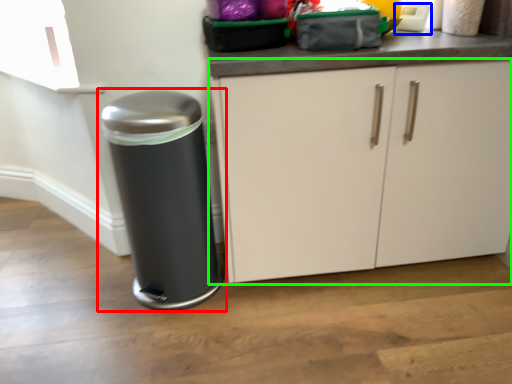
Question: Estimate the real-world distances between objects in this image. Which object is closer to waste container (highlighted by a red box), appliance (highlighted by a blue box) or cabinetry (highlighted by a green box)?

Choices:
 (A) appliance
 (B) cabinetry

Answer: (B)